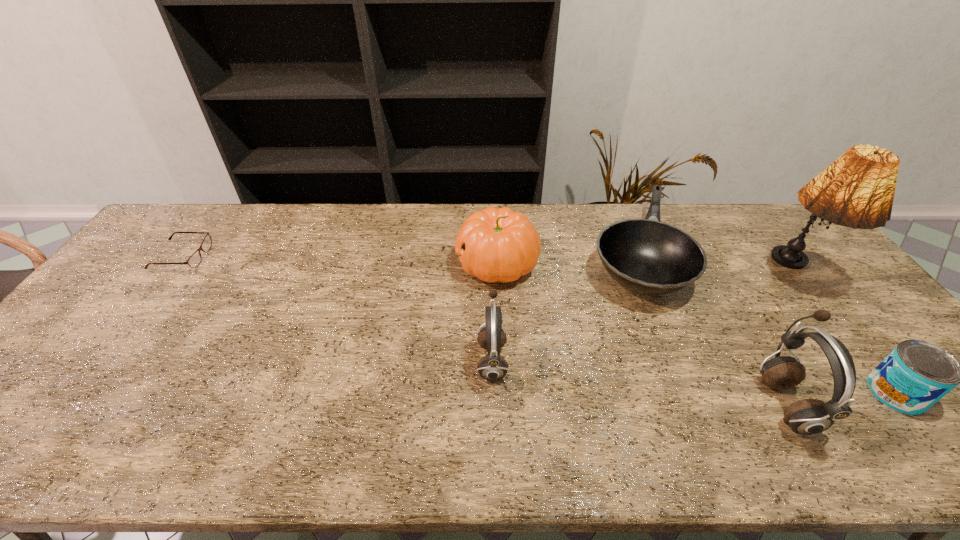
The height and width of the screenshot is (540, 960). I want to click on the left earphone, so click(492, 367).

The image size is (960, 540). Identify the location of the third object from right to left. (809, 416).

At what (x,y) coordinates should I click in order to perform the action: click on the sixth shortest object. Please return your answer as a coordinate pair (x, y). The width and height of the screenshot is (960, 540). Looking at the image, I should click on (809, 416).

This screenshot has width=960, height=540. Find the location of `frying pan`. frying pan is located at coordinates (647, 256).

Where is `spectacles`? The height and width of the screenshot is (540, 960). spectacles is located at coordinates coord(194,260).

You are a GUI agent. You are given a task and a screenshot of the screen. Output one action in this format:
    pyautogui.click(x=<x>, y=<y>)
    Task: Click on the leftmost object
    This screenshot has width=960, height=540.
    Given the screenshot: What is the action you would take?
    pyautogui.click(x=194, y=260)

Identify the location of pumpkin. (493, 244).

In order to click on the tallest object in this screenshot , I will do `click(857, 190)`.

I want to click on can, so click(x=916, y=374).

Identify the location of vacant point located 0.170m on the ear pads of the shorter earphone. This screenshot has width=960, height=540. (409, 360).